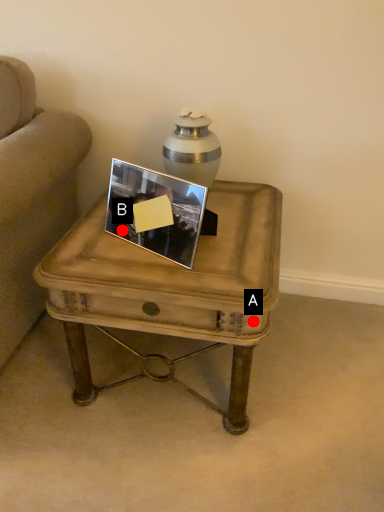
Question: Two points are circled on the image, labeled by A and B beside each circle. Which point is farther from the camera taking this photo?

Choices:
 (A) A is further
 (B) B is further

Answer: (B)